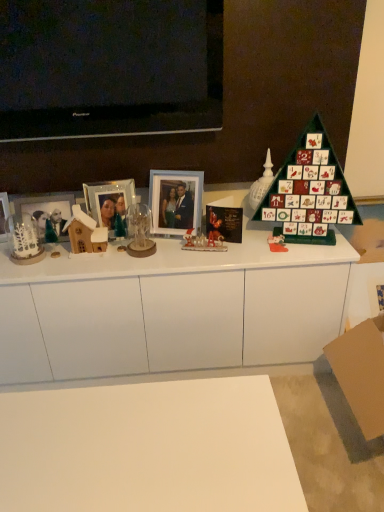
The height and width of the screenshot is (512, 384). What are the coordinates of `vacant space situated on the left part of clear glass ornament at center, the fourth toy viewed from the right` in the screenshot? It's located at (96, 261).